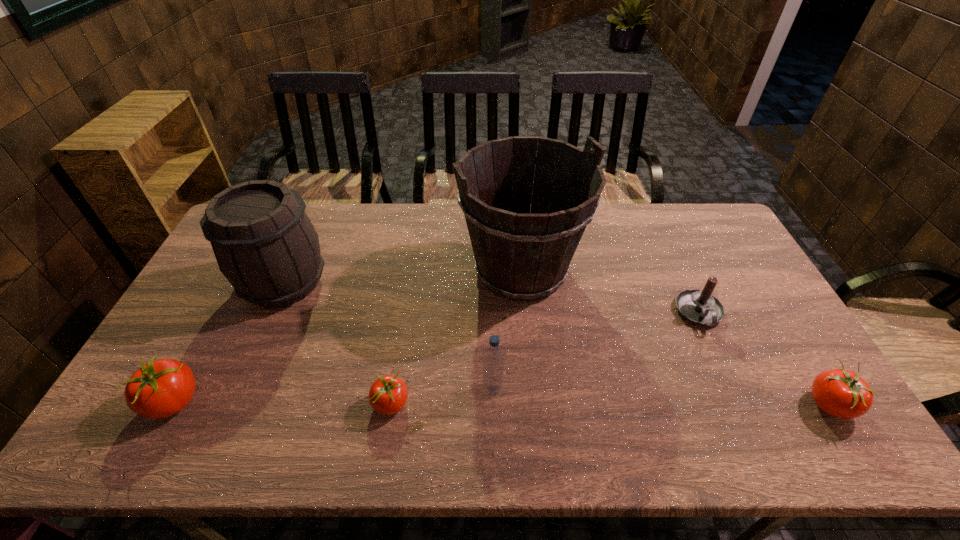
Where is `object that can be found as the second closest to the bucket`? The width and height of the screenshot is (960, 540). object that can be found as the second closest to the bucket is located at coordinates (700, 307).

Find the location of `tomato that stands as the second closest to the second tomato from left to right`. tomato that stands as the second closest to the second tomato from left to right is located at coordinates (841, 393).

Identify the location of tomato that is the closest to the water bottle. (388, 395).

Identify the location of vacant position in the image that satisfies the following two spatial constraints: 1. on the back side of the tallest object; 2. on the left side of the tallest tomato. (245, 270).

You are a GUI agent. You are given a task and a screenshot of the screen. Output one action in this format:
    pyautogui.click(x=<x>, y=<y>)
    Task: Click on the free space that satisfies the following two spatial constraints: 1. on the front side of the wine bucket; 2. on the left side of the third tallest object
    This screenshot has width=960, height=540.
    Given the screenshot: What is the action you would take?
    [237, 388]